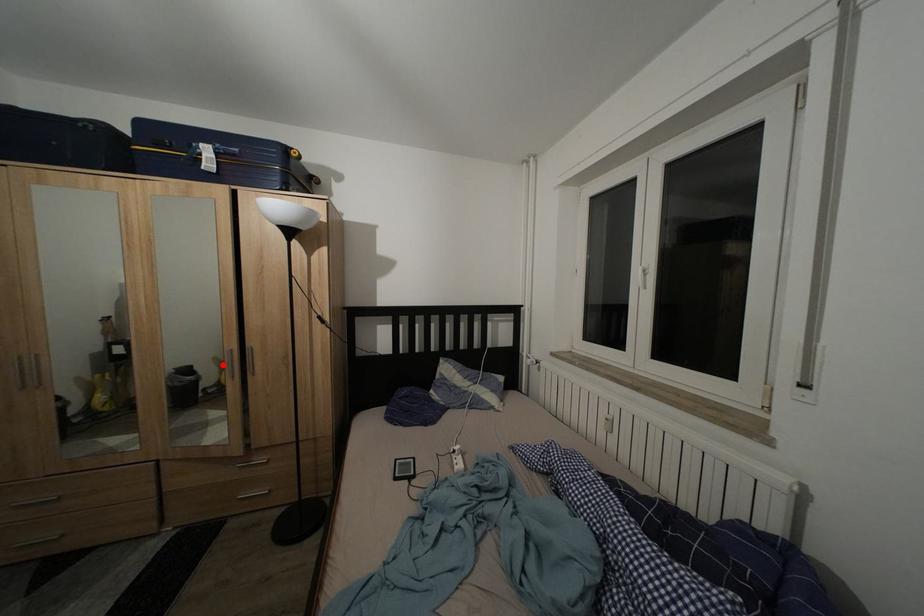
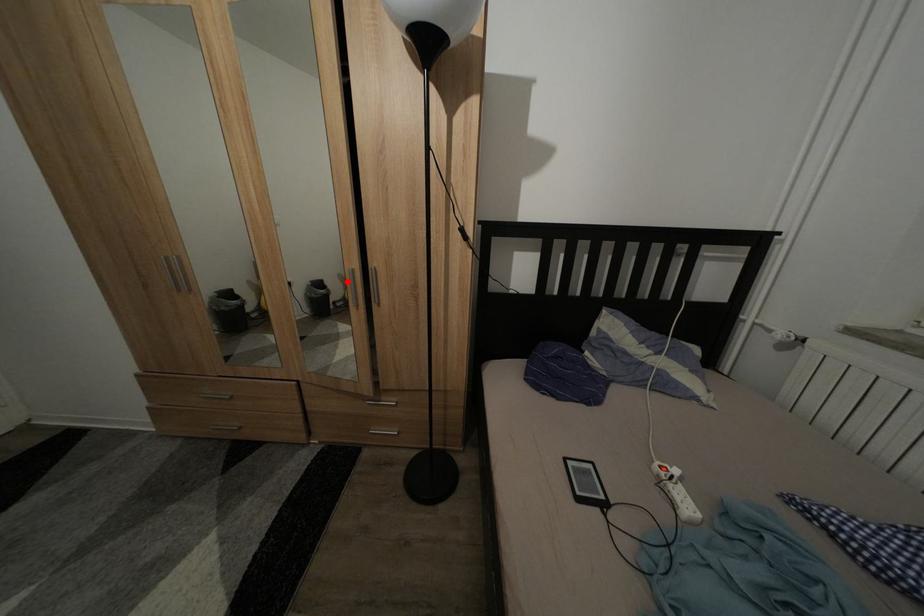
I am providing you with two images of the same scene from different viewpoints. A red point is marked on the first image and another point is marked on the second image. Does the point marked in image1 correspond to the same location as the one in image2?

Yes